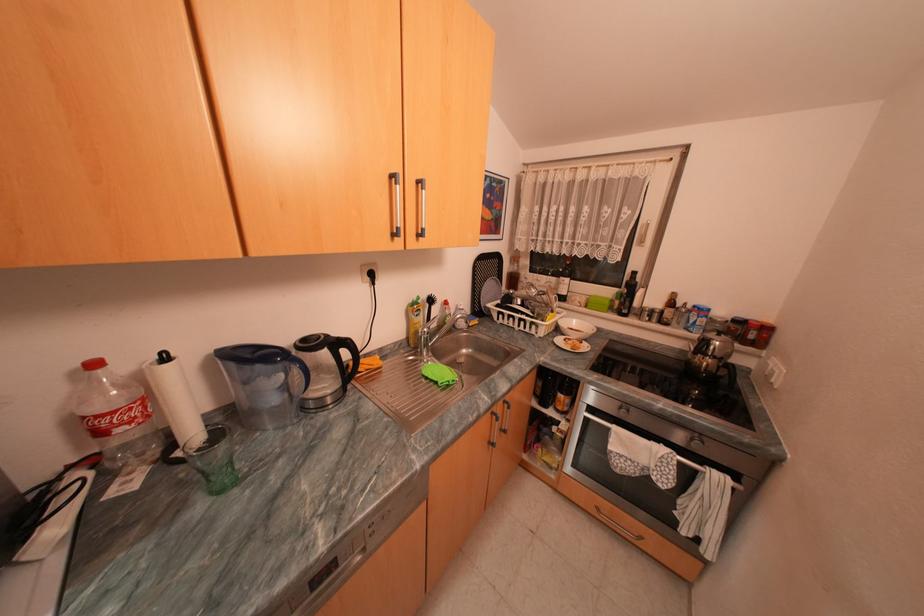
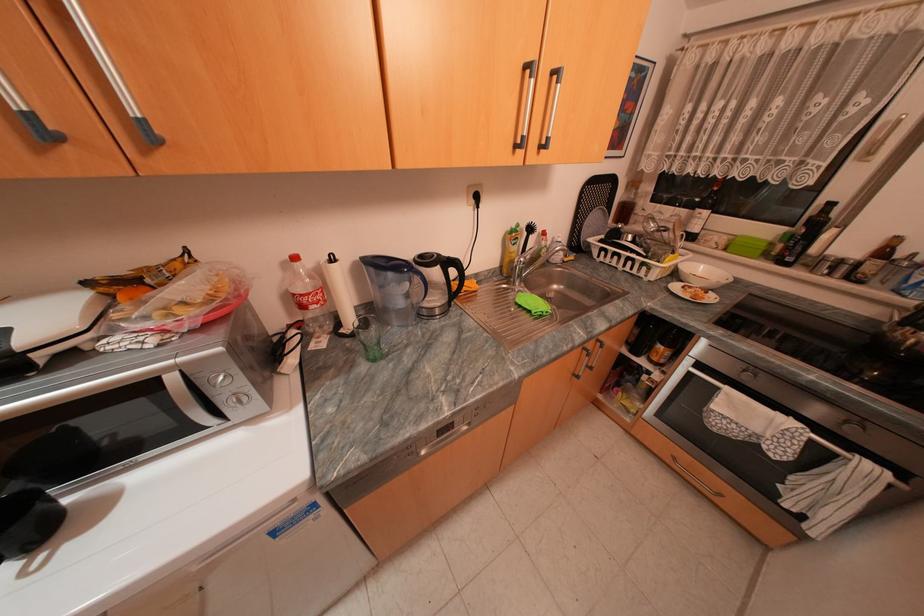
The point at (420, 357) is marked in the first image. Where is the corresponding point in the second image?

(514, 285)